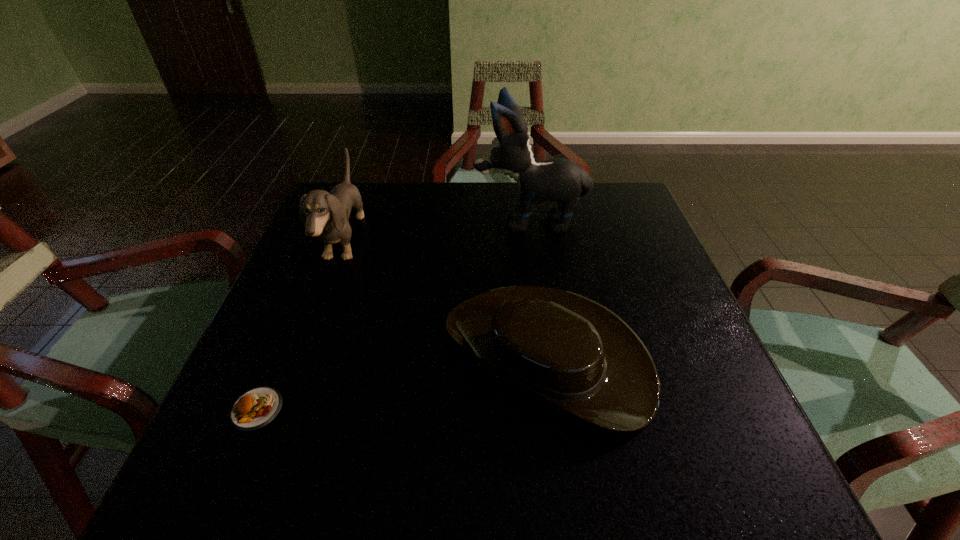
This screenshot has height=540, width=960. I want to click on vacant area at the far edge of the desktop, so click(x=394, y=184).

Locate an element on the screen. The image size is (960, 540). free region at the near edge of the desktop is located at coordinates (405, 478).

The height and width of the screenshot is (540, 960). I want to click on free spot at the left edge of the desktop, so click(293, 312).

In the image, there is a desktop. At what (x,y) coordinates should I click in order to perform the action: click on vacant region at the right edge. Please return your answer as a coordinate pair (x, y). Looking at the image, I should click on (660, 368).

In order to click on vacant area at the near left corner of the desktop in this screenshot , I will do `click(228, 497)`.

Where is `vacant region at the far right corner of the desktop`? vacant region at the far right corner of the desktop is located at coordinates (591, 193).

Where is `vacant point located between the shortest object and the shorter puppy`? Image resolution: width=960 pixels, height=540 pixels. vacant point located between the shortest object and the shorter puppy is located at coordinates (300, 325).

Where is `vacant area that lies between the right puppy and the shortest object`? The width and height of the screenshot is (960, 540). vacant area that lies between the right puppy and the shortest object is located at coordinates (393, 315).

The width and height of the screenshot is (960, 540). What are the coordinates of `blank region between the patty (food) and the third tallest object` in the screenshot? It's located at (401, 382).

What are the coordinates of `free space between the third shortest object and the patty (food)` in the screenshot? It's located at (300, 325).